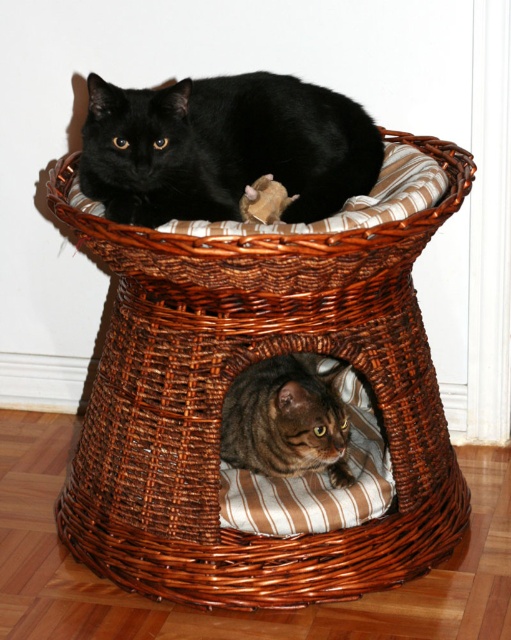
Does brown wicker basket at center come in front of tabby fur cat at center?

Yes, brown wicker basket at center is closer to the viewer.

In the scene shown: Who is higher up, brown wicker basket at center or tabby fur cat at center?

brown wicker basket at center is higher up.

Who is more forward, (357, 355) or (263, 410)?

Point (357, 355)

Find the location of a particular element. The height and width of the screenshot is (640, 511). brown wicker basket at center is located at coordinates (223, 394).

Which of these two, tabby fur cat at upper center or tabby fur cat at center, stands shorter?

With less height is tabby fur cat at center.

Is tabby fur cat at upper center to the left of tabby fur cat at center from the viewer's perspective?

Indeed, tabby fur cat at upper center is positioned on the left side of tabby fur cat at center.

The width and height of the screenshot is (511, 640). What do you see at coordinates (223, 147) in the screenshot? I see `tabby fur cat at upper center` at bounding box center [223, 147].

Identify the location of tabby fur cat at upper center. The width and height of the screenshot is (511, 640). (223, 147).

Does brown wicker basket at center have a lesser width compared to tabby fur cat at upper center?

In fact, brown wicker basket at center might be wider than tabby fur cat at upper center.

Can you confirm if brown wicker basket at center is positioned above tabby fur cat at upper center?

Incorrect, brown wicker basket at center is not positioned above tabby fur cat at upper center.

The image size is (511, 640). What do you see at coordinates (223, 394) in the screenshot? I see `brown wicker basket at center` at bounding box center [223, 394].

This screenshot has height=640, width=511. I want to click on brown wicker basket at center, so click(223, 394).